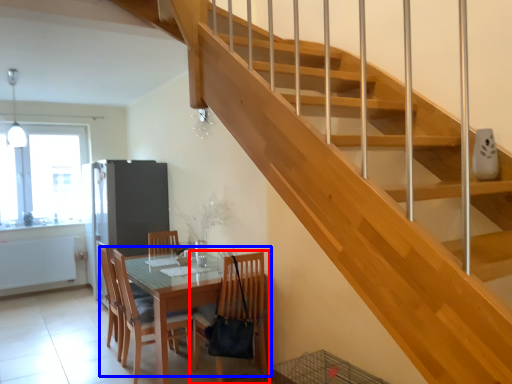
Question: Which of the following is the closest to the observer, chair (highlighted by a red box) or kitchen & dining room table (highlighted by a blue box)?

Choices:
 (A) chair
 (B) kitchen & dining room table

Answer: (B)